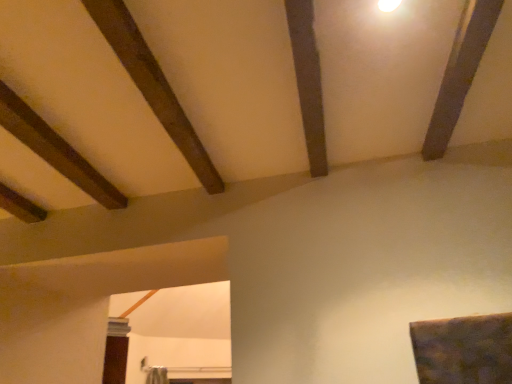
Question: Based on their positions, is dark brown wood at upper left, which is the first plank in left-to-right order, located to the left or right of dark brown wood plank at upper center, which is counted as the first plank, starting from the right?

Choices:
 (A) left
 (B) right

Answer: (A)

Question: From the image's perspective, is dark brown wood at upper left, the second plank viewed from the right, above or below dark brown wood plank at upper center, positioned as the 2th plank in left-to-right order?

Choices:
 (A) above
 (B) below

Answer: (B)

Question: Does point (185, 157) appear closer or farther from the camera than point (292, 16)?

Choices:
 (A) farther
 (B) closer

Answer: (A)

Question: From the image's perspective, relative to dark brown wood at upper left, the second plank viewed from the right, is dark brown wood plank at upper center, positioned as the 2th plank in left-to-right order, above or below?

Choices:
 (A) below
 (B) above

Answer: (B)

Question: Is point click(x=306, y=26) closer or farther from the camera than point click(x=131, y=46)?

Choices:
 (A) farther
 (B) closer

Answer: (B)

Question: Considering their positions, is dark brown wood plank at upper center, positioned as the 2th plank in left-to-right order, located in front of or behind dark brown wood at upper left, the second plank viewed from the right?

Choices:
 (A) front
 (B) behind

Answer: (B)

Question: From a real-world perspective, is dark brown wood plank at upper center, which is counted as the first plank, starting from the right, physically located above or below dark brown wood at upper left, the second plank viewed from the right?

Choices:
 (A) below
 (B) above

Answer: (A)